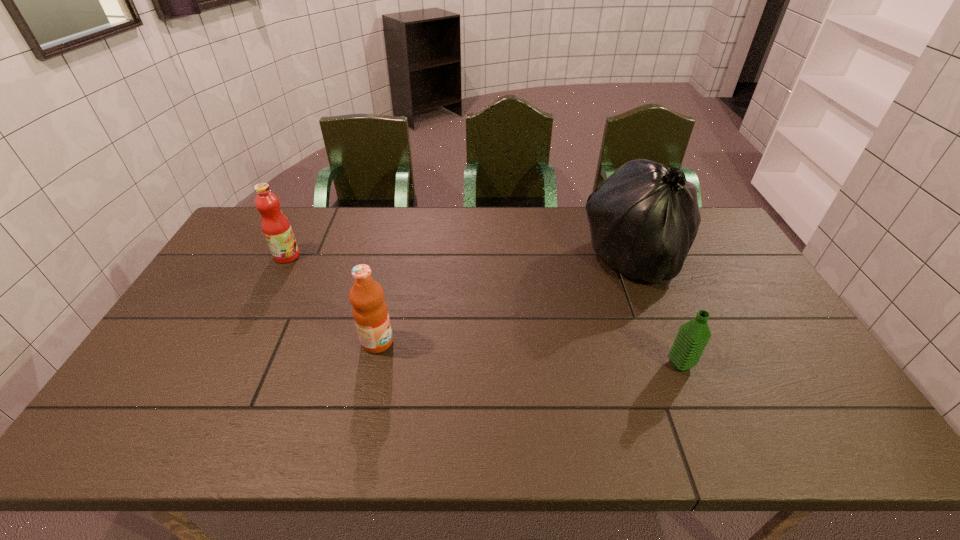
What are the coordinates of `empty space between the farther fruit juice and the nearer fruit juice` in the screenshot? It's located at (332, 299).

This screenshot has height=540, width=960. I want to click on vacant area that lies between the left fruit juice and the shortest object, so click(484, 310).

Identify the location of blank region between the left fruit juice and the tallest object. This screenshot has width=960, height=540. (461, 258).

The image size is (960, 540). What are the coordinates of `vacant point located between the left fruit juice and the tallest object` in the screenshot? It's located at (461, 258).

Identify the location of free space between the plastic bag and the leftmost object. Image resolution: width=960 pixels, height=540 pixels. (461, 258).

Identify the location of object that stands as the third closest to the shortest object. The height and width of the screenshot is (540, 960). (276, 228).

Choose which object is the second nearest neighbor to the shortest object. Please provide its 2D coordinates. Your answer should be formatted as a tuple, i.e. [(x, y)], where the tuple contains the x and y coordinates of a point satisfying the conditions above.

[(370, 312)]

Locate an element on the screen. free space that satisfies the following two spatial constraints: 1. on the front label of the plastic bag; 2. on the right side of the left fruit juice is located at coordinates (285, 259).

Locate an element on the screen. The width and height of the screenshot is (960, 540). free point that satisfies the following two spatial constraints: 1. on the front label of the right fruit juice; 2. on the right side of the water bottle is located at coordinates (372, 364).

Find the location of a particular element. The height and width of the screenshot is (540, 960). vacant area that satisfies the following two spatial constraints: 1. on the front label of the shortest object; 2. on the left side of the nearer fruit juice is located at coordinates (372, 364).